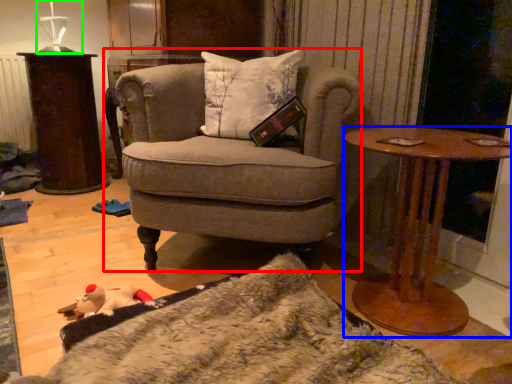
Question: Which is nearer to the chair (highlighted by a red box)? desk (highlighted by a blue box) or table lamp (highlighted by a green box).

Choices:
 (A) desk
 (B) table lamp

Answer: (A)